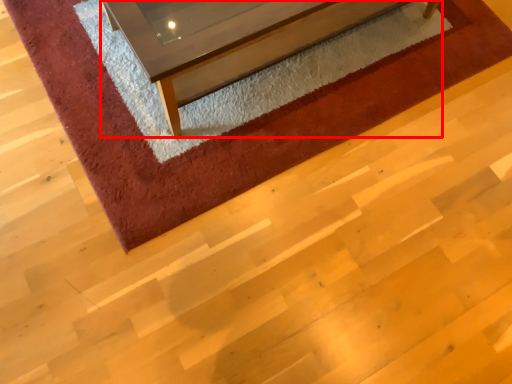
Question: From the image's perspective, where is furniture (annotated by the red box) located in relation to mat in the image?

Choices:
 (A) below
 (B) above

Answer: (B)